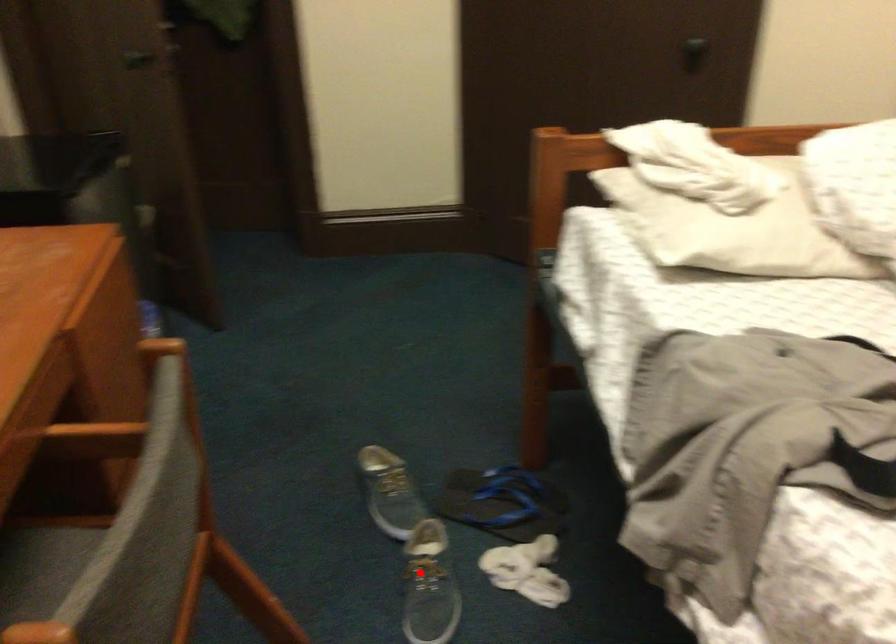
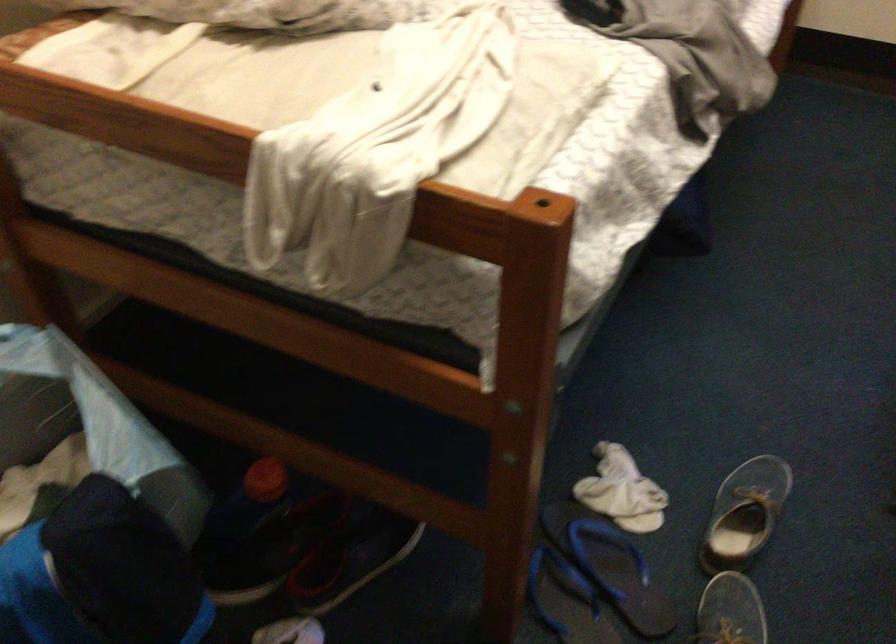
Question: I am providing you with two images of the same scene from different viewpoints. Image1 has a red point marked. In image2, the corresponding 3D location appears at what relative position? Reply with the corresponding letter.

Choices:
 (A) Closer
 (B) Farther

Answer: (A)